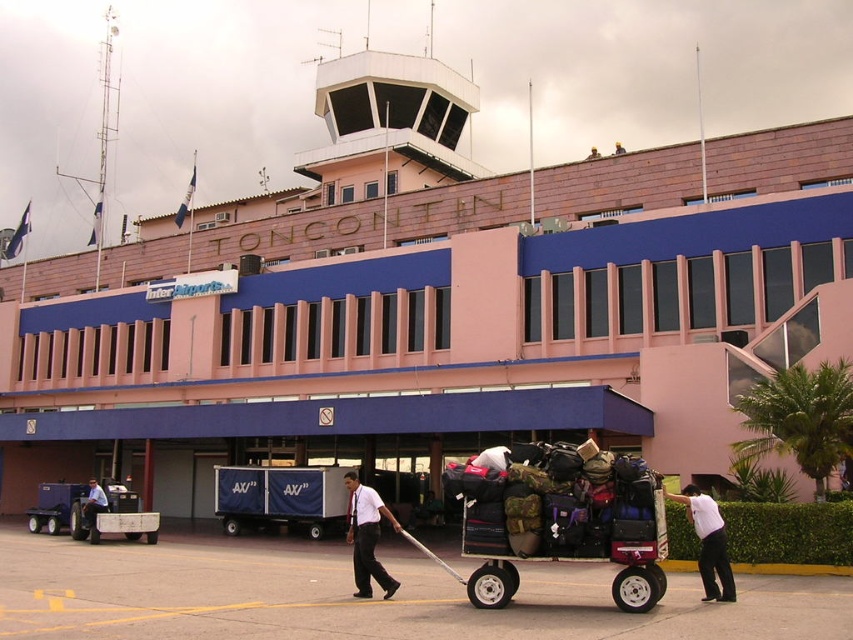
Who is positioned more to the left, metallic blue cart at left or white shirt at center?

metallic blue cart at left

The width and height of the screenshot is (853, 640). What are the coordinates of `metallic blue cart at left` in the screenshot? It's located at (91, 512).

This screenshot has width=853, height=640. I want to click on metallic blue cart at left, so click(91, 512).

Is smooth asphalt tarmac at center taller than metallic blue cart at left?

No.

Can you confirm if smooth asphalt tarmac at center is positioned below metallic blue cart at left?

Actually, smooth asphalt tarmac at center is above metallic blue cart at left.

This screenshot has height=640, width=853. What do you see at coordinates (363, 600) in the screenshot?
I see `smooth asphalt tarmac at center` at bounding box center [363, 600].

Find the location of a particular element. The width and height of the screenshot is (853, 640). smooth asphalt tarmac at center is located at coordinates (363, 600).

This screenshot has height=640, width=853. What do you see at coordinates (367, 536) in the screenshot?
I see `white shirt at center` at bounding box center [367, 536].

Is white shirt at center taller than white cotton shirt at lower right?

Correct, white shirt at center is much taller as white cotton shirt at lower right.

This screenshot has width=853, height=640. Identify the location of white shirt at center. (367, 536).